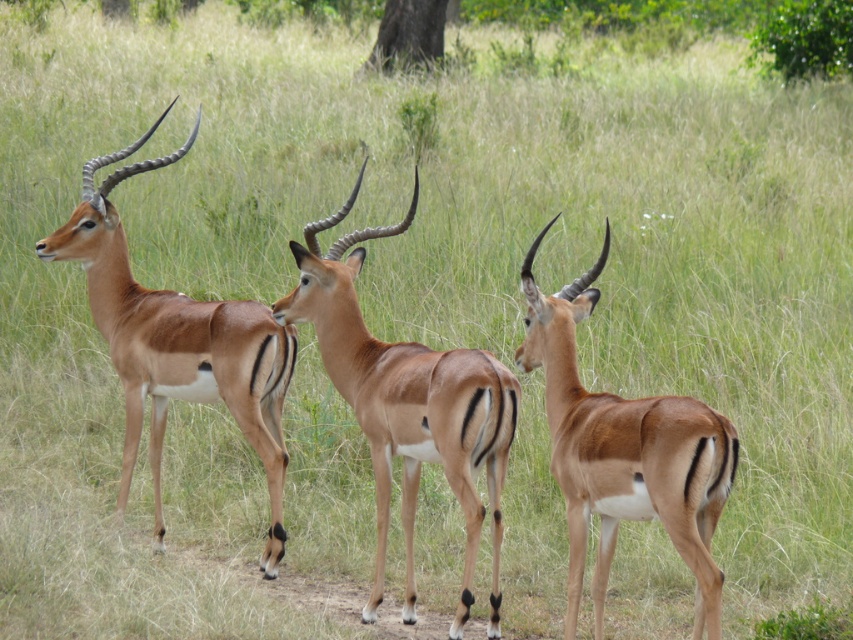
Question: Is brown matte/deer at center to the right of brown rough tree trunk at upper center from the viewer's perspective?

Choices:
 (A) yes
 (B) no

Answer: (A)

Question: Which of these objects is positioned closest to the brown matte/deer at center?

Choices:
 (A) brown rough tree trunk at upper center
 (B) brown glossy antelope at left
 (C) brown glossy antelope at center

Answer: (C)

Question: Which point appears farthest from the camera in this image?

Choices:
 (A) (550, 358)
 (B) (285, 323)

Answer: (B)

Question: Can you confirm if brown glossy antelope at left is bigger than brown rough tree trunk at upper center?

Choices:
 (A) yes
 (B) no

Answer: (B)

Question: Among these objects, which one is farthest from the camera?

Choices:
 (A) brown rough tree trunk at upper center
 (B) brown glossy antelope at left

Answer: (A)

Question: Does brown matte/deer at center have a larger size compared to brown glossy antelope at left?

Choices:
 (A) yes
 (B) no

Answer: (B)